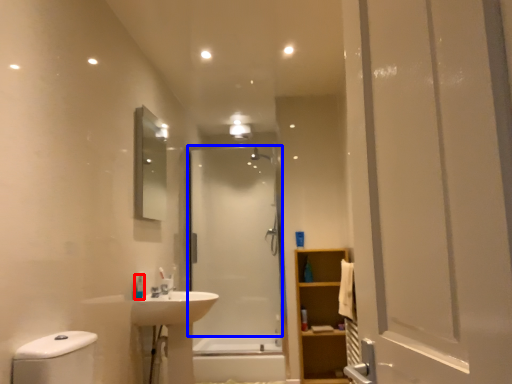
Question: Which object appears closest to the camera in this image, toiletry (highlighted by a red box) or screen door (highlighted by a blue box)?

Choices:
 (A) toiletry
 (B) screen door

Answer: (A)